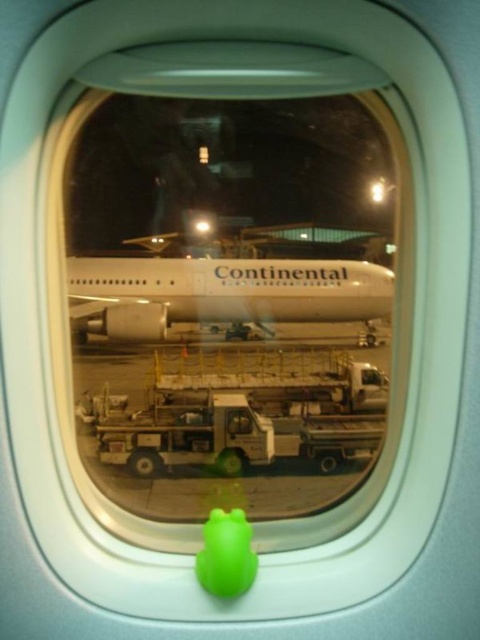
You are a passenger on an airplane and notice two objects at the center of your view through the window. The objects are the white glossy airplane at center and the green rubber duck at center. Which object is closer to you?

The green rubber duck at center is closer to you because it is on the window sill, while the white glossy airplane at center is outside the airplane window, making it farther away.

You are a passenger on an airplane and notice two objects at the center of your view through the window. One is the white glossy airplane at center and the other is the green rubber duck at center. Which object appears bigger in your view?

The white glossy airplane at center is larger in size than the green rubber duck at center, so the white glossy airplane at center appears bigger in your view.

You are a passenger sitting in the airplane and looking out the window. You see the white glossy airplane at center and the green rubber duck at center. Which object is closer to you?

The green rubber duck at center is closer to you because it is positioned in front of the white glossy airplane at center.